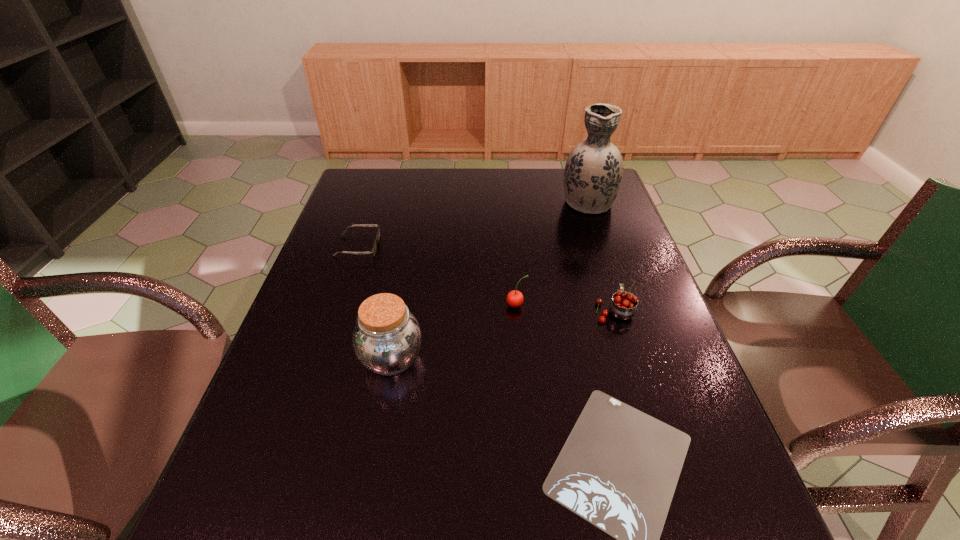
The image size is (960, 540). I want to click on vase, so click(593, 172).

Find the location of a particular element. the farthest object is located at coordinates (593, 172).

The image size is (960, 540). Identify the location of the fifth shortest object. (387, 337).

Where is `the fifth object from right to left`? The image size is (960, 540). the fifth object from right to left is located at coordinates (387, 337).

This screenshot has height=540, width=960. Find the location of `the right cherry`. the right cherry is located at coordinates (623, 305).

The width and height of the screenshot is (960, 540). What are the coordinates of `the left cherry` in the screenshot? It's located at (514, 298).

The width and height of the screenshot is (960, 540). In order to click on the fifth nearest object in this screenshot , I will do `click(373, 251)`.

Locate an element on the screen. This screenshot has height=540, width=960. sunglasses is located at coordinates (373, 251).

Locate an element on the screen. This screenshot has height=540, width=960. free point located on the back of the fifth object from right to left is located at coordinates (408, 272).

Image resolution: width=960 pixels, height=540 pixels. In order to click on vacant space situated 0.260m on the handle side of the right cherry in this screenshot , I will do pyautogui.click(x=591, y=236).